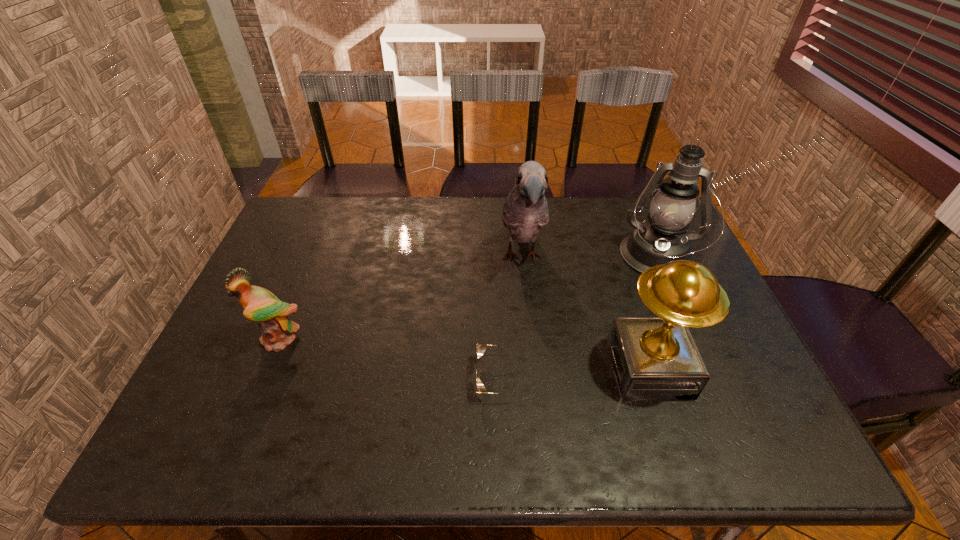
The image size is (960, 540). Identify the location of free location that satisfies the following two spatial constraints: 1. on the front side of the oil lamp; 2. on the front lenses of the sunglasses. (707, 378).